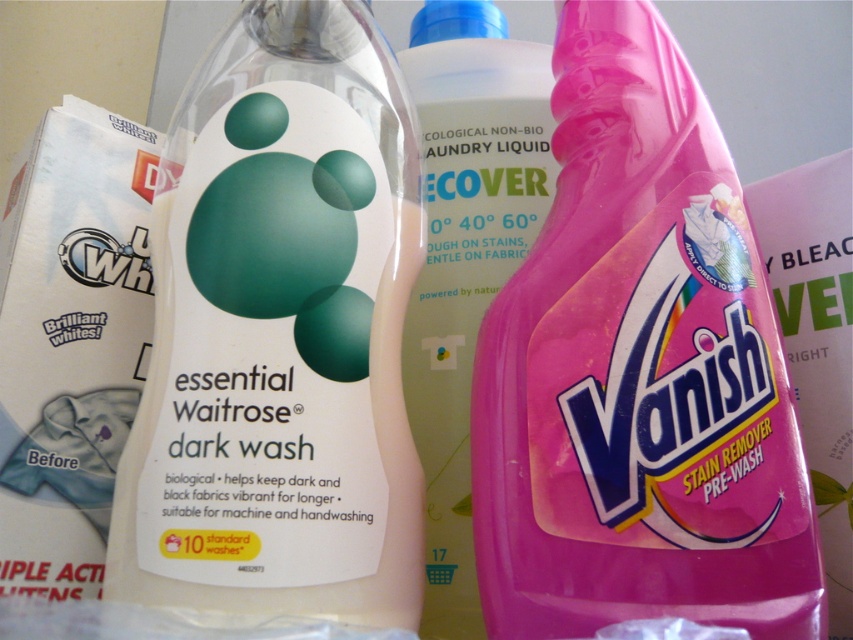
You are organizing a laundry room and need to place a new stain remover bottle. The existing stain remover is located at point (637, 372). Where should you place the new bottle to ensure it is not directly overlapping with the existing one?

The point (637, 372) marks the location of the pink plastic Vanish Stain Remover at right. To avoid overlapping, place the new bottle elsewhere in the laundry room arrangement.

You are organizing laundry products on a shelf. You have a white matte bottle at center and a translucent plastic bottle at center. Which bottle should you place on the lower shelf if you want the shorter one to be at the bottom?

The white matte bottle at center is not as tall as the translucent plastic bottle at center, so you should place the white matte bottle at center on the lower shelf since it is shorter.